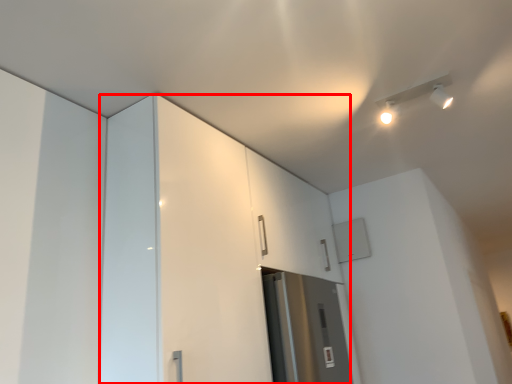
Question: Considering the relative positions of dresser (annotated by the red box) and light fixture in the image provided, where is dresser (annotated by the red box) located with respect to the staircase?

Choices:
 (A) right
 (B) left

Answer: (B)